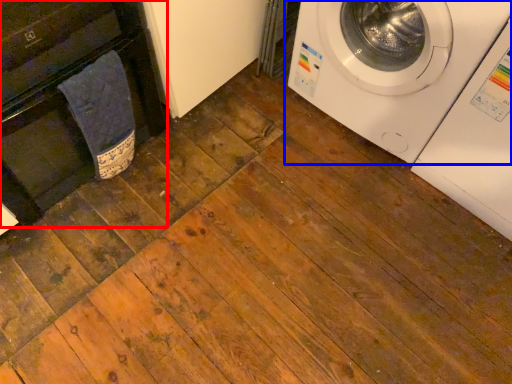
Question: Which of the following is the farthest to the observer, dish washer (highlighted by a red box) or washing machine (highlighted by a blue box)?

Choices:
 (A) dish washer
 (B) washing machine

Answer: (B)